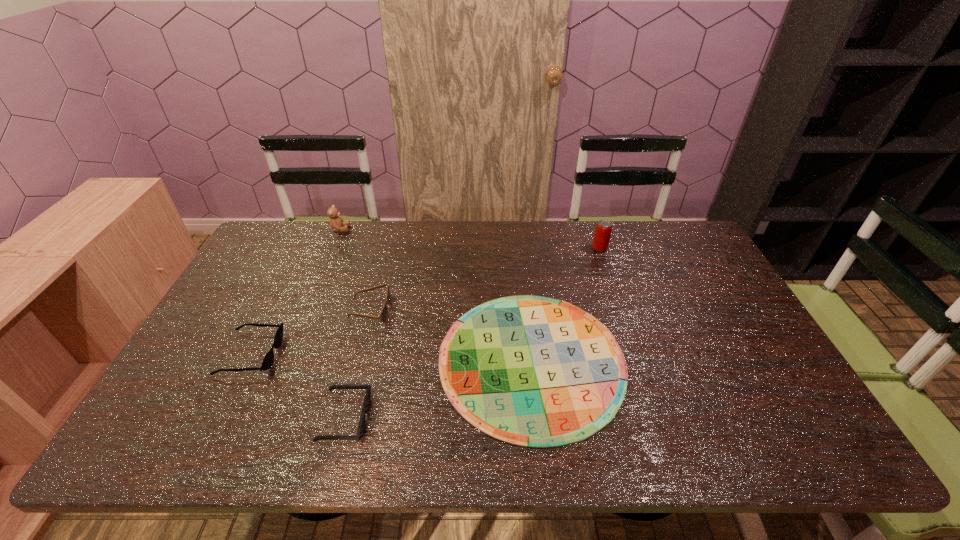
Where is `the rightmost object`? The image size is (960, 540). the rightmost object is located at coordinates (603, 229).

Image resolution: width=960 pixels, height=540 pixels. What are the coordinates of `the fifth nearest object` in the screenshot? It's located at (603, 229).

Where is `teddy bear`? This screenshot has width=960, height=540. teddy bear is located at coordinates (336, 223).

Find the location of a particular element. Image resolution: width=960 pixels, height=540 pixels. the farthest object is located at coordinates (336, 223).

This screenshot has width=960, height=540. What are the coordinates of `the farthest sunglasses` in the screenshot? It's located at (383, 316).

Find the location of `the leftmost sunglasses`. the leftmost sunglasses is located at coordinates (267, 362).

The height and width of the screenshot is (540, 960). I want to click on the fifth tallest object, so click(361, 427).

Find the location of a particular element. Image resolution: width=960 pixels, height=540 pixels. the nearest sunglasses is located at coordinates (361, 427).

Image resolution: width=960 pixels, height=540 pixels. In order to click on the shortest object in this screenshot , I will do `click(533, 371)`.

Image resolution: width=960 pixels, height=540 pixels. Identify the location of the second object from right to left. (533, 371).